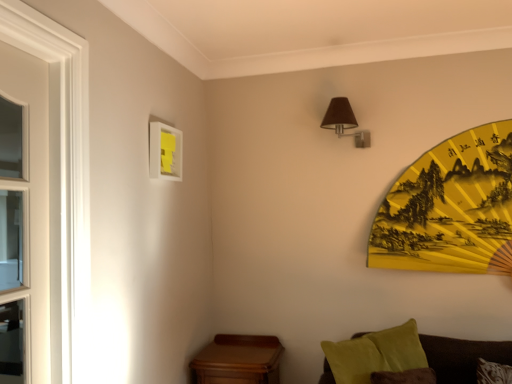
Question: Is brown fabric lampshade at upper right situated inside yellow paper fan at upper right or outside?

Choices:
 (A) inside
 (B) outside

Answer: (B)

Question: Is point (x=354, y=127) closer or farther from the camera than point (x=416, y=188)?

Choices:
 (A) closer
 (B) farther

Answer: (B)

Question: Which object is the closest to the wooden table at lower left?

Choices:
 (A) white matte picture frame at upper left
 (B) yellow paper fan at upper right
 (C) brown fabric lampshade at upper right

Answer: (A)

Question: Estimate the real-world distances between objects in this image. Which object is closer to the brown fabric lampshade at upper right?

Choices:
 (A) wooden table at lower left
 (B) yellow paper fan at upper right
 (C) white matte picture frame at upper left

Answer: (B)